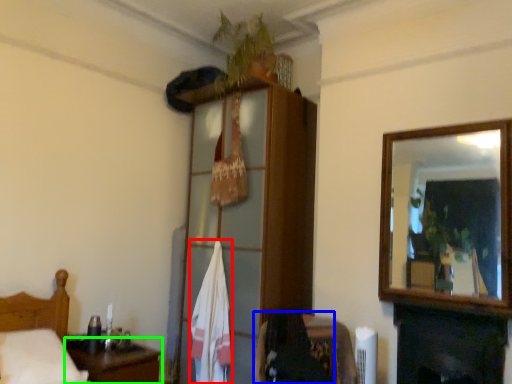
Question: Which is farther away from bath towel (highlighted by a red box)? chair (highlighted by a blue box) or table (highlighted by a green box)?

Choices:
 (A) chair
 (B) table

Answer: (A)